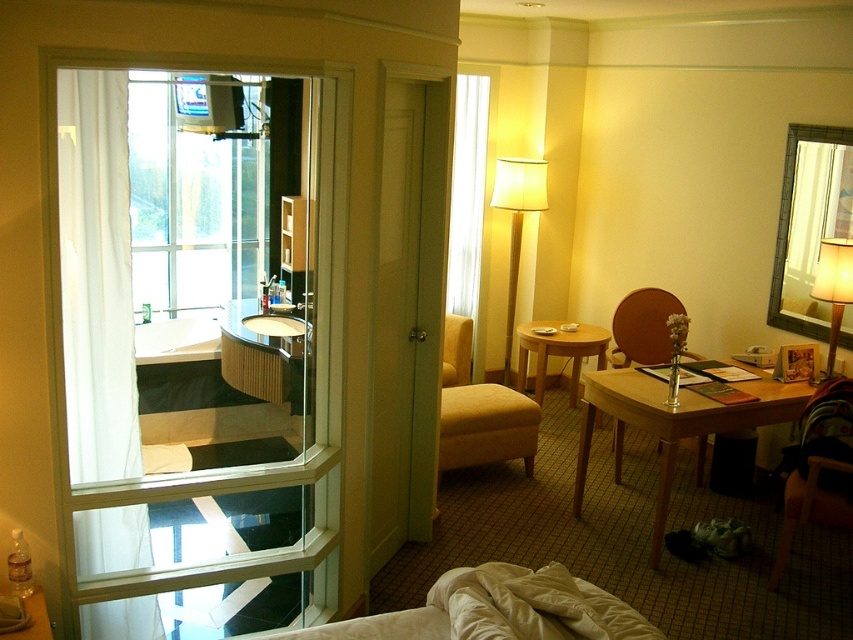
Question: Does white sheer curtain at left appear under green matte closet door at center?

Choices:
 (A) no
 (B) yes

Answer: (B)

Question: Which of the following is the closest to the observer?

Choices:
 (A) (525, 444)
 (B) (517, 273)
 (C) (460, 369)
 (D) (206, 193)

Answer: (A)

Question: Is clear glass window at upper left thinner than wooden table at center?

Choices:
 (A) no
 (B) yes

Answer: (A)

Question: Is transparent glass door at left to the right of light brown wooden table at center from the viewer's perspective?

Choices:
 (A) no
 (B) yes

Answer: (A)

Question: Which object is farther from the camera taking this photo?

Choices:
 (A) yellow fabric armchair at center
 (B) matte black mirror at upper right
 (C) transparent glass door at left
 (D) green matte closet door at center

Answer: (C)

Question: Which object is the farthest from the beige velvety bed at lower center?

Choices:
 (A) white sheer curtain at left
 (B) light brown wooden table at center
 (C) matte white lampshade at upper right

Answer: (B)